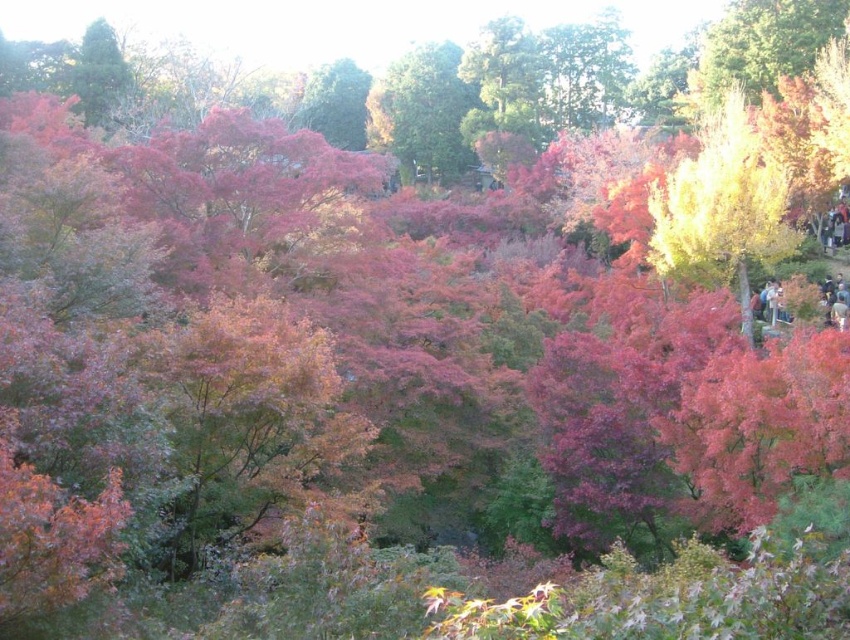
Question: Is yellow-green leafy tree at right to the left of green matte tree at center from the viewer's perspective?

Choices:
 (A) no
 (B) yes

Answer: (A)

Question: Can you confirm if yellow-green leafy tree at right is thinner than green matte tree at center?

Choices:
 (A) no
 (B) yes

Answer: (B)

Question: Is yellow-green leafy tree at right wider than green matte tree at center?

Choices:
 (A) yes
 (B) no

Answer: (B)

Question: Which object appears farthest from the camera in this image?

Choices:
 (A) green matte tree at center
 (B) yellow-green leafy tree at right

Answer: (A)

Question: Which point is closer to the camera taking this photo?

Choices:
 (A) (415, 132)
 (B) (727, 147)

Answer: (B)

Question: Which object is farther from the camera taking this photo?

Choices:
 (A) green matte tree at center
 (B) yellow-green leafy tree at right

Answer: (A)